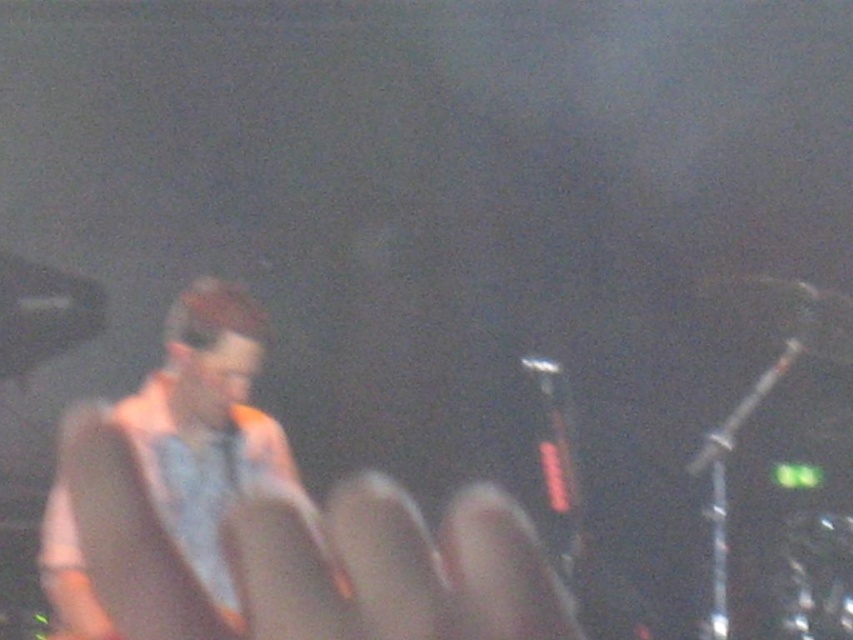
Can you confirm if matte gray hand at center is wider than light brown leather jacket at left?

No.

The height and width of the screenshot is (640, 853). What do you see at coordinates (397, 570) in the screenshot?
I see `matte gray hand at center` at bounding box center [397, 570].

At what (x,y) coordinates should I click in order to perform the action: click on matte gray hand at center. Please return your answer as a coordinate pair (x, y). This screenshot has height=640, width=853. Looking at the image, I should click on [x=397, y=570].